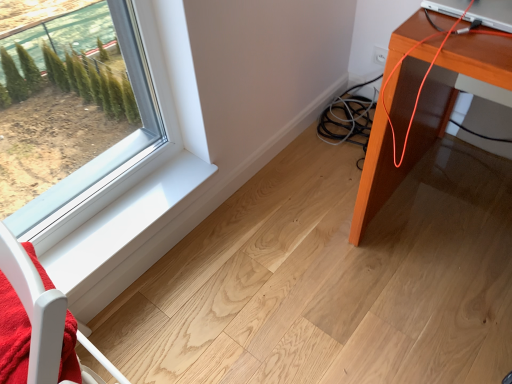
The width and height of the screenshot is (512, 384). In order to click on silver metallic laptop at upper right in this screenshot , I will do (x=492, y=14).

Locate an element on the screen. The width and height of the screenshot is (512, 384). orange wood table at right is located at coordinates (426, 118).

This screenshot has width=512, height=384. I want to click on white wood chair at lower left, so click(x=35, y=309).

Which of these two, white wood chair at lower left or orange wood table at right, is bigger?

Bigger between the two is orange wood table at right.

Does white wood chair at lower left have a lesser width compared to orange wood table at right?

Yes, white wood chair at lower left is thinner than orange wood table at right.

Is white wood chair at lower left taller or shorter than orange wood table at right?

In the image, white wood chair at lower left appears to be shorter than orange wood table at right.

The image size is (512, 384). I want to click on table that appears on the right of white wood chair at lower left, so click(426, 118).

Can you confirm if orange wood table at right is smaller than silver metallic laptop at upper right?

Actually, orange wood table at right might be larger than silver metallic laptop at upper right.

Is the depth of orange wood table at right greater than that of silver metallic laptop at upper right?

No, the depth of orange wood table at right is less than that of silver metallic laptop at upper right.

In the image, there is a silver metallic laptop at upper right. At what (x,y) coordinates should I click in order to perform the action: click on table below it (from the image's perspective). Please return your answer as a coordinate pair (x, y). The image size is (512, 384). Looking at the image, I should click on (426, 118).

Consider the image. Does orange wood table at right turn towards silver metallic laptop at upper right?

No, orange wood table at right is not aimed at silver metallic laptop at upper right.

From a real-world perspective, is white smooth window sill at lower left on silver metallic laptop at upper right?

No.

Is white smooth window sill at lower left taller or shorter than silver metallic laptop at upper right?

white smooth window sill at lower left is shorter than silver metallic laptop at upper right.

From the image's perspective, would you say orange wood table at right is positioned over white wood chair at lower left?

Yes, from the image's perspective, orange wood table at right is over white wood chair at lower left.

Would you say white wood chair at lower left is part of orange wood table at right's contents?

No, white wood chair at lower left is not a part of orange wood table at right.

Based on the photo, is orange wood table at right positioned with its back to white wood chair at lower left?

No, orange wood table at right is not facing away from white wood chair at lower left.

Is white wood chair at lower left directly adjacent to white smooth window sill at lower left?

They are not placed beside each other.

Is white wood chair at lower left at the right side of white smooth window sill at lower left?

No.

Could you tell me if white wood chair at lower left is facing white smooth window sill at lower left?

No.

Between orange wood table at right and white smooth window sill at lower left, which one has smaller size?

white smooth window sill at lower left.

In the image, is orange wood table at right positioned in front of or behind white smooth window sill at lower left?

In the image, orange wood table at right appears in front of white smooth window sill at lower left.

Is orange wood table at right positioned beyond the bounds of white smooth window sill at lower left?

orange wood table at right lies outside white smooth window sill at lower left's area.

From the image's perspective, is orange wood table at right above or below white smooth window sill at lower left?

Based on their image positions, orange wood table at right is located above white smooth window sill at lower left.

Considering the sizes of objects white wood chair at lower left and silver metallic laptop at upper right in the image provided, who is shorter, white wood chair at lower left or silver metallic laptop at upper right?

With less height is silver metallic laptop at upper right.

Considering the sizes of objects white wood chair at lower left and silver metallic laptop at upper right in the image provided, who is wider, white wood chair at lower left or silver metallic laptop at upper right?

Wider between the two is silver metallic laptop at upper right.

Based on the photo, is white wood chair at lower left directly adjacent to silver metallic laptop at upper right?

There is a gap between white wood chair at lower left and silver metallic laptop at upper right.

Locate an element on the screen. table that appears on the right of white wood chair at lower left is located at coordinates (426, 118).

Where is `desktop computer above the orange wood table at right (from a real-world perspective)`? The image size is (512, 384). desktop computer above the orange wood table at right (from a real-world perspective) is located at coordinates (492, 14).

Which object lies nearer to the anchor point white smooth window sill at lower left, orange wood table at right or silver metallic laptop at upper right?

orange wood table at right is closer to white smooth window sill at lower left.

Looking at the image, which one is located closer to white smooth window sill at lower left, white wood chair at lower left or silver metallic laptop at upper right?

white wood chair at lower left lies closer to white smooth window sill at lower left than the other object.

Looking at the image, which one is located closer to silver metallic laptop at upper right, white wood chair at lower left or white smooth window sill at lower left?

white wood chair at lower left lies closer to silver metallic laptop at upper right than the other object.

When comparing their distances from silver metallic laptop at upper right, does white smooth window sill at lower left or white wood chair at lower left seem further?

white smooth window sill at lower left is further to silver metallic laptop at upper right.

From the image, which object appears to be farther from silver metallic laptop at upper right, white wood chair at lower left or orange wood table at right?

The object further to silver metallic laptop at upper right is white wood chair at lower left.

Which object lies further to the anchor point silver metallic laptop at upper right, orange wood table at right or white smooth window sill at lower left?

The object further to silver metallic laptop at upper right is white smooth window sill at lower left.

Based on their spatial positions, is white smooth window sill at lower left or orange wood table at right further from silver metallic laptop at upper right?

Based on the image, white smooth window sill at lower left appears to be further to silver metallic laptop at upper right.

Looking at the image, which one is located closer to orange wood table at right, white smooth window sill at lower left or silver metallic laptop at upper right?

Based on the image, silver metallic laptop at upper right appears to be nearer to orange wood table at right.

At what (x,y) coordinates should I click in order to perform the action: click on window sill between white wood chair at lower left and silver metallic laptop at upper right. Please return your answer as a coordinate pair (x, y). The height and width of the screenshot is (384, 512). Looking at the image, I should click on (122, 235).

The height and width of the screenshot is (384, 512). Identify the location of window sill between white wood chair at lower left and orange wood table at right from left to right. (122, 235).

In order to click on desktop computer between white smooth window sill at lower left and orange wood table at right in this screenshot , I will do `click(492, 14)`.

What are the coordinates of `desktop computer situated between white wood chair at lower left and orange wood table at right from left to right` in the screenshot? It's located at (492, 14).